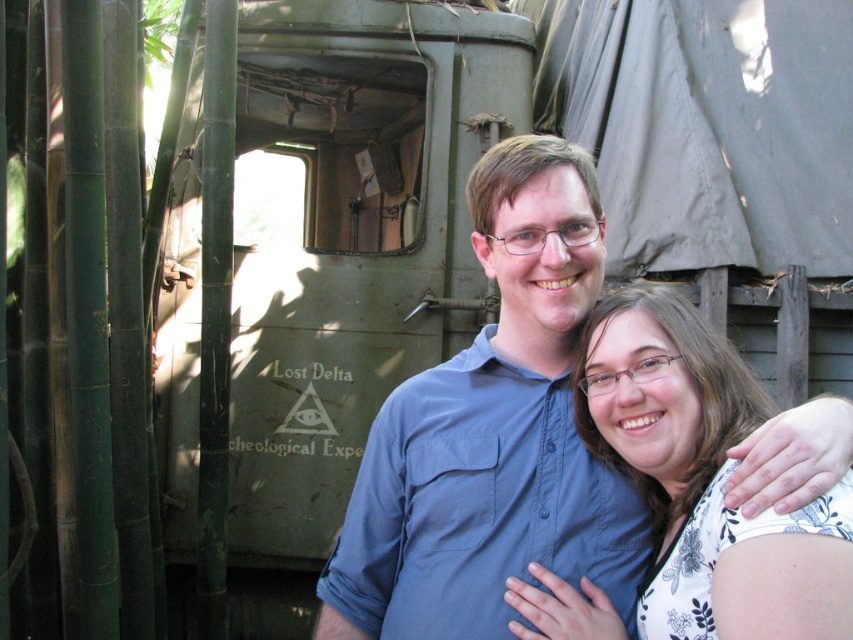
Question: Is blue cotton shirt at center to the right of white floral blouse at center from the viewer's perspective?

Choices:
 (A) no
 (B) yes

Answer: (A)

Question: Does blue cotton shirt at center appear over white floral blouse at center?

Choices:
 (A) no
 (B) yes

Answer: (B)

Question: Among these points, which one is farthest from the camera?

Choices:
 (A) (764, 628)
 (B) (518, 467)

Answer: (B)

Question: Which object is farther from the camera taking this photo?

Choices:
 (A) white floral blouse at center
 (B) blue cotton shirt at center

Answer: (B)

Question: Among these points, which one is farthest from the camera?

Choices:
 (A) (782, 488)
 (B) (606, 352)

Answer: (B)

Question: Is blue cotton shirt at center closer to camera compared to white floral blouse at center?

Choices:
 (A) no
 (B) yes

Answer: (A)